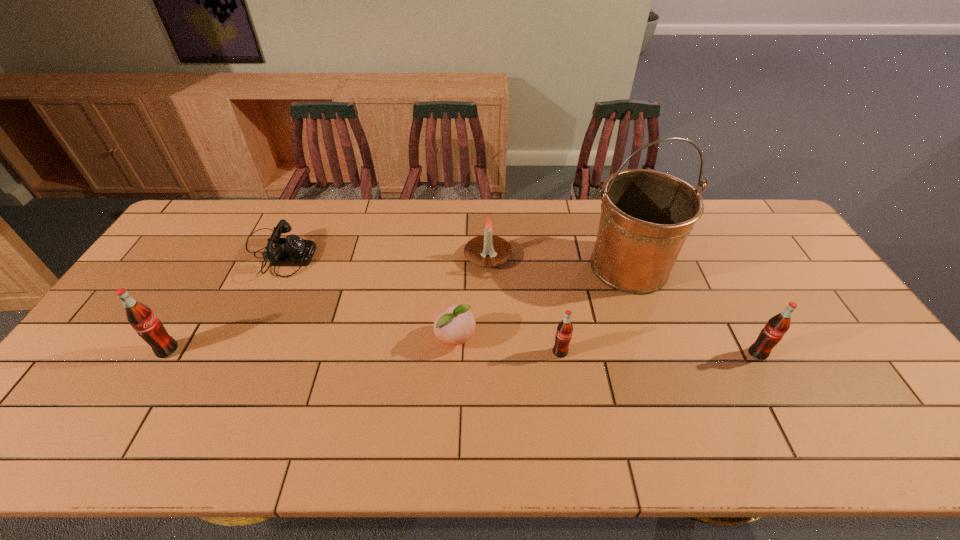
Where is `the leftmost soda bottle`? This screenshot has width=960, height=540. the leftmost soda bottle is located at coordinates (143, 320).

Find the location of `the second soda bottle from right to left`. the second soda bottle from right to left is located at coordinates (563, 336).

Locate an element on the screen. the shortest soda bottle is located at coordinates (563, 336).

You are a GUI agent. You are given a task and a screenshot of the screen. Output one action in this format:
    pyautogui.click(x=<x>, y=<y>)
    Task: Click on the rightmost object
    
    Given the screenshot: What is the action you would take?
    pyautogui.click(x=778, y=325)

Find the location of a particular element. This screenshot has height=540, width=960. the second tallest soda bottle is located at coordinates (778, 325).

Find the location of `telephone`. telephone is located at coordinates pos(291,251).

Locate an element on the screen. The image size is (960, 540). the second object from left to right is located at coordinates (291, 251).

Locate an element on the screen. bucket is located at coordinates [x=646, y=216].

Find the location of `the tallest object`. the tallest object is located at coordinates (646, 216).

The image size is (960, 540). I want to click on candle, so click(487, 250).